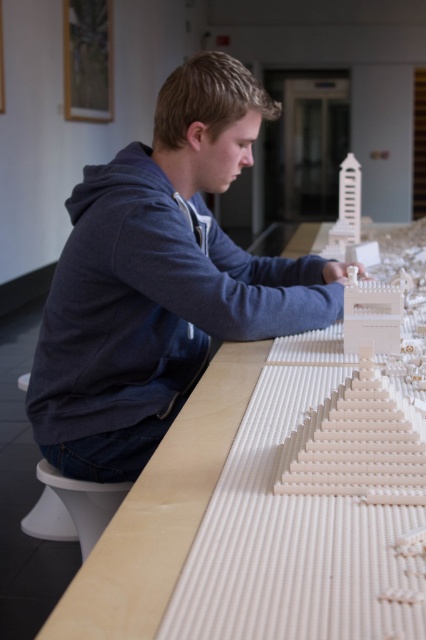
Question: Which point appears farthest from the camera in this image?

Choices:
 (A) (164, 211)
 (B) (299, 227)

Answer: (B)

Question: Which of the following is the closest to the observer?

Choices:
 (A) dark blue hoodie at center
 (B) light brown wood table at center

Answer: (A)

Question: Can you confirm if dark blue hoodie at center is smaller than light brown wood table at center?

Choices:
 (A) no
 (B) yes

Answer: (A)

Question: Which point is closer to the camera taking this photo?

Choices:
 (A) (132, 355)
 (B) (175, 548)

Answer: (B)

Question: Can you confirm if dark blue hoodie at center is positioned to the left of light brown wood table at center?

Choices:
 (A) no
 (B) yes

Answer: (B)

Question: Is dark blue hoodie at center closer to the viewer compared to light brown wood table at center?

Choices:
 (A) yes
 (B) no

Answer: (A)